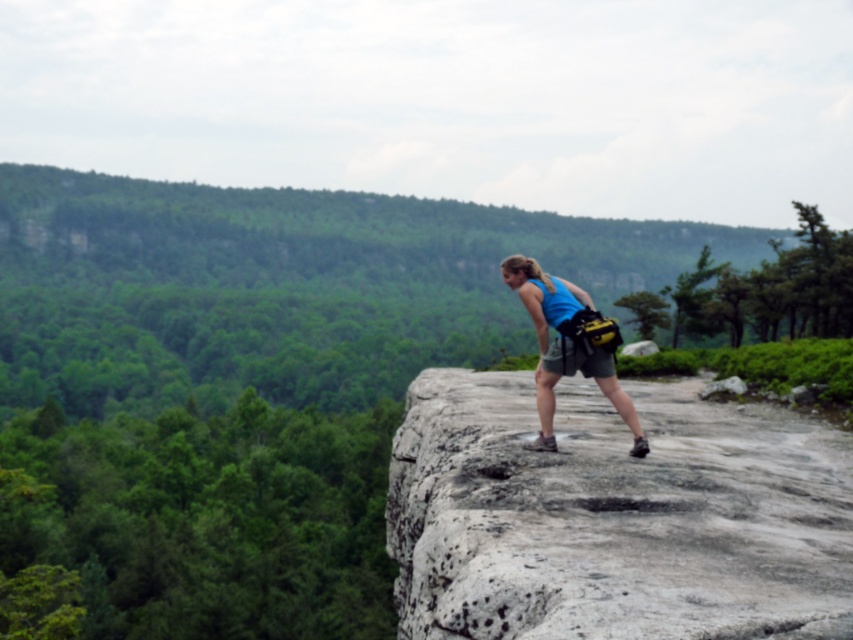
Question: Can you confirm if gray rough rock at center is positioned to the left of blue fabric tank top at center?

Choices:
 (A) yes
 (B) no

Answer: (B)

Question: Does gray rough rock at center appear on the right side of blue fabric tank top at center?

Choices:
 (A) yes
 (B) no

Answer: (A)

Question: Which of the following is the closest to the observer?

Choices:
 (A) blue fabric tank top at center
 (B) gray rough rock at center

Answer: (B)

Question: Does gray rough rock at center have a smaller size compared to blue fabric tank top at center?

Choices:
 (A) no
 (B) yes

Answer: (A)